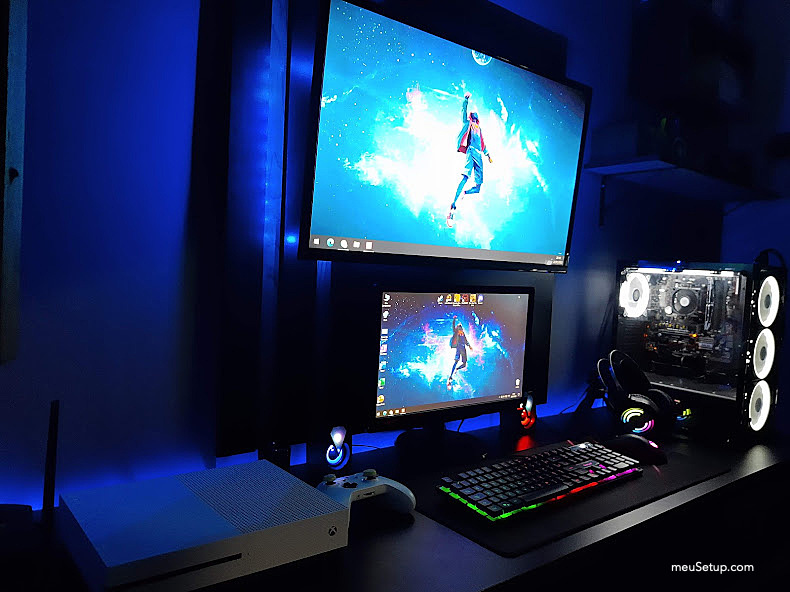
Where is `screen`? screen is located at coordinates (434, 133), (427, 371).